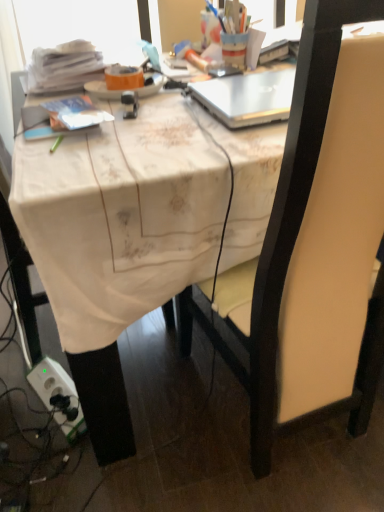
This screenshot has width=384, height=512. What do you see at coordinates (314, 247) in the screenshot? I see `matte black chair at center` at bounding box center [314, 247].

What are the coordinates of `orange matte plate at upper center` in the screenshot? It's located at (102, 90).

Where is `matte black chair at center`? This screenshot has height=512, width=384. matte black chair at center is located at coordinates (314, 247).

From a real-world perspective, which is physically below, silver metallic laptop at upper center or orange matte plate at upper center?

In real-world perspective, orange matte plate at upper center is lower.

Is silver metallic laptop at upper center behind orange matte plate at upper center?

No, it is not.

How far apart are silver metallic laptop at upper center and matte black chair at center?

silver metallic laptop at upper center and matte black chair at center are 16.40 inches apart.

Is silver metallic laptop at upper center with matte black chair at center?

No, silver metallic laptop at upper center is not next to matte black chair at center.

Considering the points (293, 74) and (306, 124), which point is in front, point (293, 74) or point (306, 124)?

The point (306, 124) is in front.

From the image's perspective, between silver metallic laptop at upper center and matte black chair at center, who is located below?

matte black chair at center.

What's the angular difference between orange matte plate at upper center and matte black chair at center's facing directions?

The facing directions of orange matte plate at upper center and matte black chair at center are 3.62 degrees apart.

Between orange matte plate at upper center and matte black chair at center, which one has smaller size?

With smaller size is orange matte plate at upper center.

From the image's perspective, who appears lower, orange matte plate at upper center or matte black chair at center?

matte black chair at center appears lower in the image.

Which is behind, orange matte plate at upper center or matte black chair at center?

orange matte plate at upper center is more distant.

Between white fabric-covered desk at center and silver metallic laptop at upper center, which one has larger width?

With larger width is white fabric-covered desk at center.

Considering the sizes of white fabric-covered desk at center and silver metallic laptop at upper center in the image, is white fabric-covered desk at center taller or shorter than silver metallic laptop at upper center?

white fabric-covered desk at center is taller than silver metallic laptop at upper center.

Where is `desk below the silver metallic laptop at upper center (from a real-world perspective)`? This screenshot has width=384, height=512. desk below the silver metallic laptop at upper center (from a real-world perspective) is located at coordinates (118, 239).

Looking at this image, is matte black chair at center facing away from silver metallic laptop at upper center?

Yes, silver metallic laptop at upper center is at the back of matte black chair at center.

Is the surface of matte black chair at center in direct contact with silver metallic laptop at upper center?

There is a gap between matte black chair at center and silver metallic laptop at upper center.

Can you confirm if matte black chair at center is thinner than silver metallic laptop at upper center?

No, matte black chair at center is not thinner than silver metallic laptop at upper center.

Is matte black chair at center at the right side of silver metallic laptop at upper center?

Correct, you'll find matte black chair at center to the right of silver metallic laptop at upper center.

Consider the image. Which of these two, orange matte plate at upper center or white fabric-covered desk at center, is wider?

Wider between the two is white fabric-covered desk at center.

Consider the image. Does orange matte plate at upper center appear on the right side of white fabric-covered desk at center?

In fact, orange matte plate at upper center is to the left of white fabric-covered desk at center.

Considering the positions of point (140, 91) and point (26, 165), is point (140, 91) closer or farther from the camera than point (26, 165)?

Point (140, 91).

Identify the location of desk in front of the orange matte plate at upper center. (118, 239).

Is silver metallic laptop at upper center facing towards white fabric-covered desk at center?

No, silver metallic laptop at upper center does not turn towards white fabric-covered desk at center.

Locate an element on the screen. desk below the silver metallic laptop at upper center (from a real-world perspective) is located at coordinates (118, 239).

Can you tell me how much silver metallic laptop at upper center and white fabric-covered desk at center differ in facing direction?

There is a 0.772-degree angle between the facing directions of silver metallic laptop at upper center and white fabric-covered desk at center.

From a real-world perspective, is silver metallic laptop at upper center on white fabric-covered desk at center?

Correct, in the physical world, silver metallic laptop at upper center is higher than white fabric-covered desk at center.

Where is `plate above the silver metallic laptop at upper center (from the image's perspective)`? The width and height of the screenshot is (384, 512). plate above the silver metallic laptop at upper center (from the image's perspective) is located at coordinates (102, 90).

Locate an element on the screen. This screenshot has height=512, width=384. laptop behind the matte black chair at center is located at coordinates (247, 97).

Based on their spatial positions, is orange matte plate at upper center or matte black chair at center closer to white fabric-covered desk at center?

matte black chair at center is closer to white fabric-covered desk at center.

In the scene shown: Based on their spatial positions, is white fabric-covered desk at center or orange matte plate at upper center closer to matte black chair at center?

Among the two, white fabric-covered desk at center is located nearer to matte black chair at center.

Looking at the image, which one is located closer to orange matte plate at upper center, matte black chair at center or silver metallic laptop at upper center?

silver metallic laptop at upper center.

Which object lies further to the anchor point white fabric-covered desk at center, matte black chair at center or silver metallic laptop at upper center?

silver metallic laptop at upper center is positioned further to the anchor white fabric-covered desk at center.

Estimate the real-world distances between objects in this image. Which object is further from white fabric-covered desk at center, orange matte plate at upper center or silver metallic laptop at upper center?

orange matte plate at upper center lies further to white fabric-covered desk at center than the other object.

Looking at the image, which one is located closer to silver metallic laptop at upper center, white fabric-covered desk at center or matte black chair at center?

white fabric-covered desk at center is positioned closer to the anchor silver metallic laptop at upper center.

Considering their positions, is silver metallic laptop at upper center positioned closer to orange matte plate at upper center than matte black chair at center?

silver metallic laptop at upper center is closer to orange matte plate at upper center.

Considering their positions, is matte black chair at center positioned closer to silver metallic laptop at upper center than orange matte plate at upper center?

orange matte plate at upper center is closer to silver metallic laptop at upper center.

You are a GUI agent. You are given a task and a screenshot of the screen. Output one action in this format:
    pyautogui.click(x=<x>, y=<y>)
    Task: Click on the laptop between matte black chair at center and orange matte plate at upper center from front to back
    
    Given the screenshot: What is the action you would take?
    pyautogui.click(x=247, y=97)

The width and height of the screenshot is (384, 512). Identify the location of desk between matte black chair at center and silver metallic laptop at upper center along the z-axis. (118, 239).

The height and width of the screenshot is (512, 384). I want to click on desk positioned between matte black chair at center and orange matte plate at upper center from near to far, so click(118, 239).

Locate an element on the screen. laptop between orange matte plate at upper center and white fabric-covered desk at center is located at coordinates (247, 97).